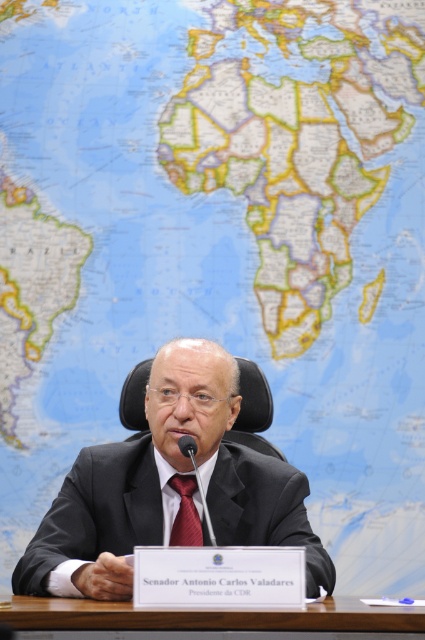
You are a photographer setting up for a formal photo shoot in the described scene. You need to position a small microphone stand between the black suit at center and the brown wooden table at center. Based on their positions, where should you place the microphone stand?

The black suit at center is located above the brown wooden table at center, so the microphone stand should be placed between them at the same level as the table since the suit is elevated.

Based on the photo, you are a photographer taking a portrait of the man. You need to focus on either the red satin tie at center or the black plastic microphone at center. Which object should you focus on if you want to capture the one that is positioned to the left?

The red satin tie at center is to the left of the black plastic microphone at center, so you should focus on the red satin tie at center to capture the one on the left.